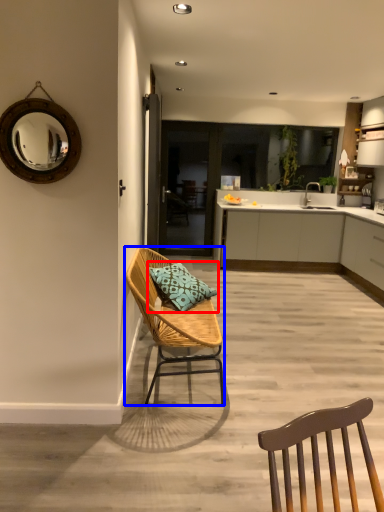
Question: Which object is further to the camera taking this photo, pillow (highlighted by a red box) or chair (highlighted by a blue box)?

Choices:
 (A) pillow
 (B) chair

Answer: (A)